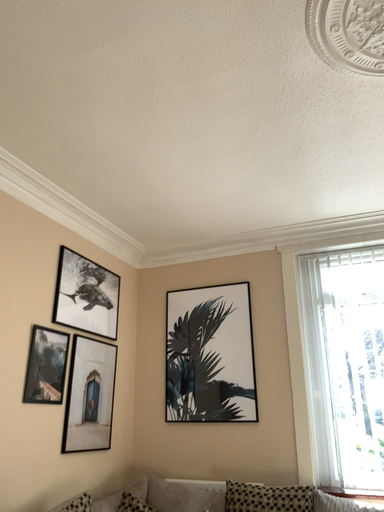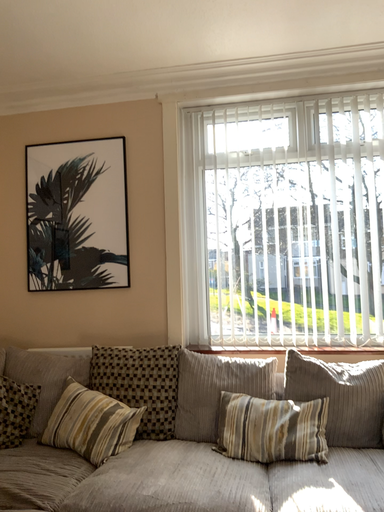
Question: Which way did the camera rotate in the video?

Choices:
 (A) rotated upward
 (B) rotated downward

Answer: (B)